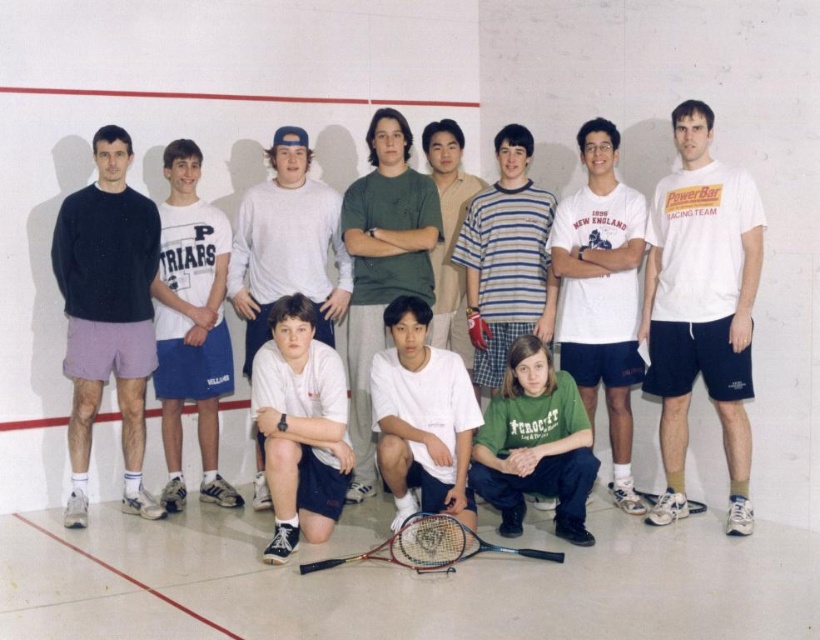
You are standing at point point (172, 346) and want to take a photo of the entire group. The camera you have can capture a maximum distance of 5 meters. Will the camera be able to capture the entire group in one shot?

The distance between point (172, 346) and the camera is 5.64 meters, which exceeds the camera maximum distance of 5 meters. Therefore, the camera cannot capture the entire group in one shot.

You are standing in the squash court and see two points marked on the wall. The first point is at coordinates point [172,157] and the second point is at point [561,404]. Which point is closer to you?

Point [172,157] is closer to you because it is further to the viewer than point [561,404].